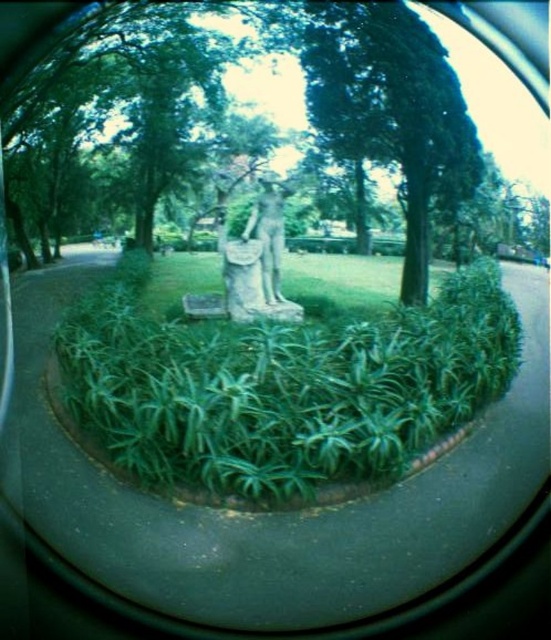
Question: Which of the following is the closest to the observer?

Choices:
 (A) (255, 204)
 (B) (263, 280)
 (C) (417, 380)
 (D) (355, 125)

Answer: (C)

Question: Can you confirm if green leafy tree at center is smaller than smooth stone statue at center?

Choices:
 (A) no
 (B) yes

Answer: (A)

Question: From the image, what is the correct spatial relationship of green leafy grass at center in relation to smooth stone statue at center?

Choices:
 (A) above
 (B) below

Answer: (B)

Question: Which of the following is the closest to the observer?

Choices:
 (A) smooth stone statue at center
 (B) stone statue at center

Answer: (A)

Question: Can you confirm if green leafy grass at center is bigger than smooth stone statue at center?

Choices:
 (A) yes
 (B) no

Answer: (B)

Question: Which object is closer to the camera taking this photo?

Choices:
 (A) green leafy grass at center
 (B) smooth stone statue at center
 (C) green leafy tree at center
 (D) stone statue at center

Answer: (A)